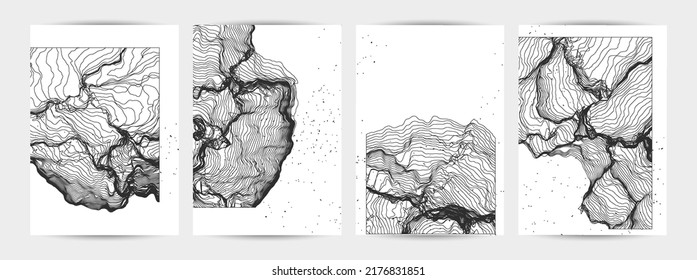
I want to click on space right of pictures, so click(674, 123).